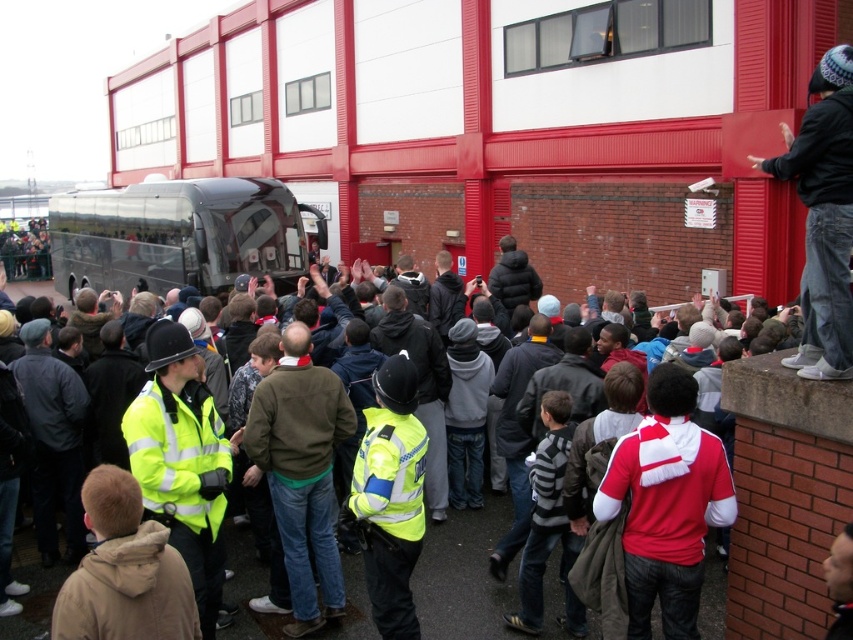
You are a photographer standing in front of the red and white building. You want to take a picture of the red and white jersey at center without the matte black bus at center blocking it. What should you do?

The red and white jersey at center is behind the matte black bus at center, so you should move to a position where the bus is no longer between you and the jersey to capture it without obstruction.

Looking at this image, you are standing in front of the building and want to move from point (131, 220) to point (695, 605). Since you can only move forward, will you be moving towards or away from the building?

Point (131, 220) is further to the viewer than point (695, 605). So moving from point (131, 220) to point (695, 605) means you are moving away from the building.